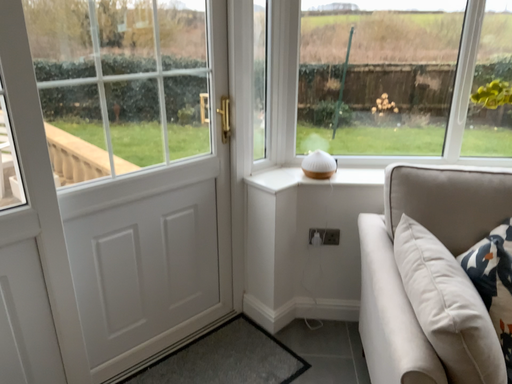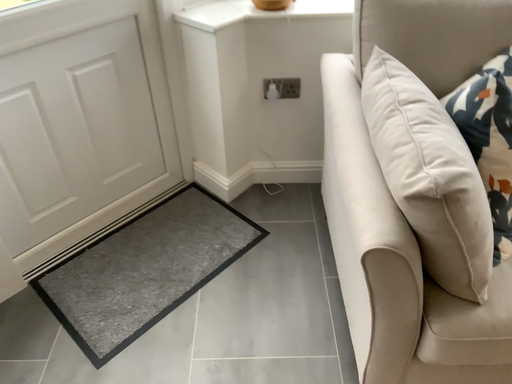
Question: Which way did the camera rotate in the video?

Choices:
 (A) rotated downward
 (B) rotated upward

Answer: (A)